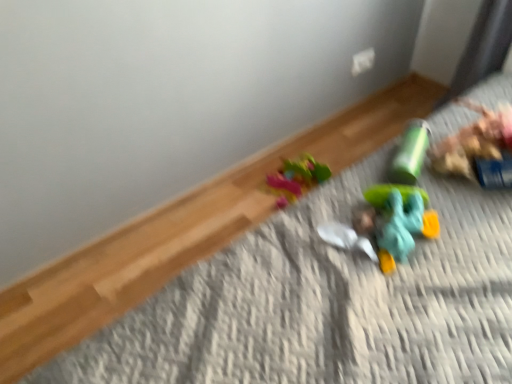
Question: In the image, is translucent teal toy at lower right, which is the 2th toy from top to bottom, positioned in front of or behind green matte cylinder at upper right, acting as the second toy starting from the front?

Choices:
 (A) behind
 (B) front

Answer: (B)

Question: Does point (424, 228) appear closer or farther from the camera than point (410, 122)?

Choices:
 (A) closer
 (B) farther

Answer: (A)

Question: Estimate the real-world distances between objects in this image. Which object is farther from the smooth plastic head at center?

Choices:
 (A) green matte cylinder at upper right, which is counted as the first toy, starting from the back
 (B) translucent teal toy at lower right, which ranks as the 2th toy in back-to-front order

Answer: (A)

Question: Which is nearer to the translucent teal toy at lower right, which ranks as the 1th toy in front-to-back order?

Choices:
 (A) green matte cylinder at upper right, which is counted as the first toy, starting from the back
 (B) smooth plastic head at center

Answer: (B)